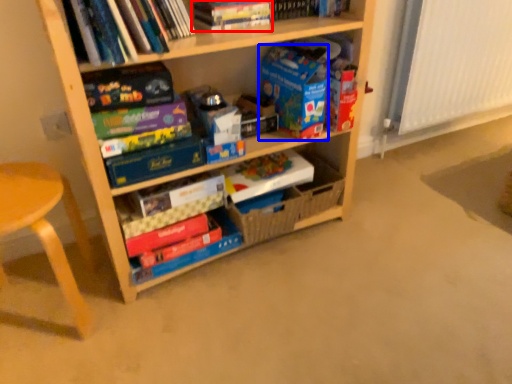
Question: Which object is closer to the camera taking this photo, book (highlighted by a red box) or paperback book (highlighted by a blue box)?

Choices:
 (A) book
 (B) paperback book

Answer: (A)